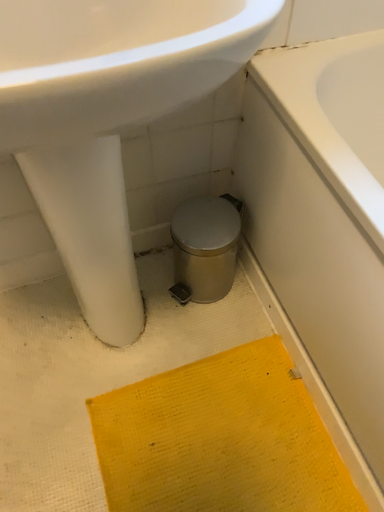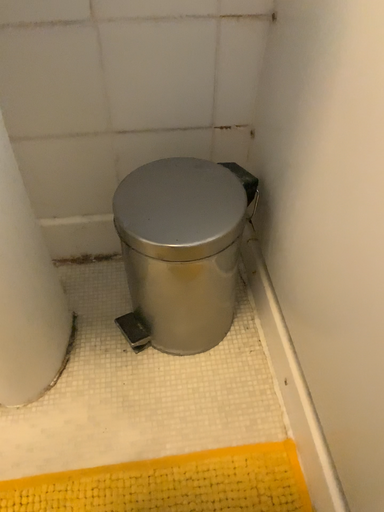
Question: Which way did the camera rotate in the video?

Choices:
 (A) rotated upward
 (B) rotated downward

Answer: (A)